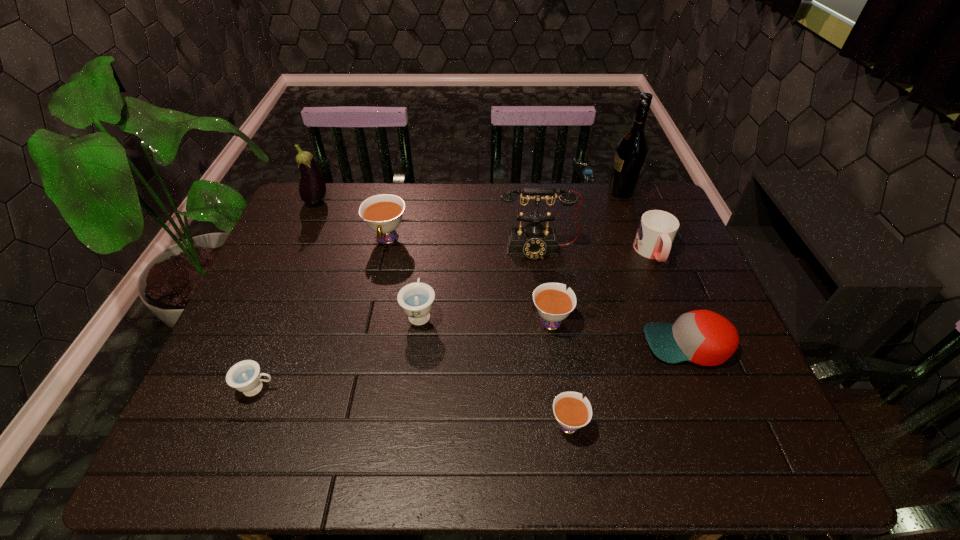
Find the location of `teacup located at the left edge`. teacup located at the left edge is located at coordinates (244, 376).

In order to click on wine bottle at the right edge in this screenshot , I will do `click(631, 152)`.

What are the coordinates of `mug at the right edge` in the screenshot? It's located at (657, 229).

The width and height of the screenshot is (960, 540). I want to click on baseball cap situated at the right edge, so click(x=703, y=337).

Locate an element on the screen. The width and height of the screenshot is (960, 540). object that is positioned at the far left corner is located at coordinates (312, 187).

In order to click on object that is at the far right corner in this screenshot , I will do `click(631, 152)`.

Locate an element on the screen. This screenshot has width=960, height=540. vacant space at the far edge is located at coordinates (353, 199).

Where is `vacant position at the left edge of the desktop`? The image size is (960, 540). vacant position at the left edge of the desktop is located at coordinates (230, 343).

In the image, there is a desktop. Where is `vacant area at the right edge`? This screenshot has height=540, width=960. vacant area at the right edge is located at coordinates (694, 301).

In the image, there is a desktop. At what (x,y) coordinates should I click in order to perform the action: click on vacant region at the far left corner. Please return your answer as a coordinate pair (x, y). The image size is (960, 540). Looking at the image, I should click on (327, 186).